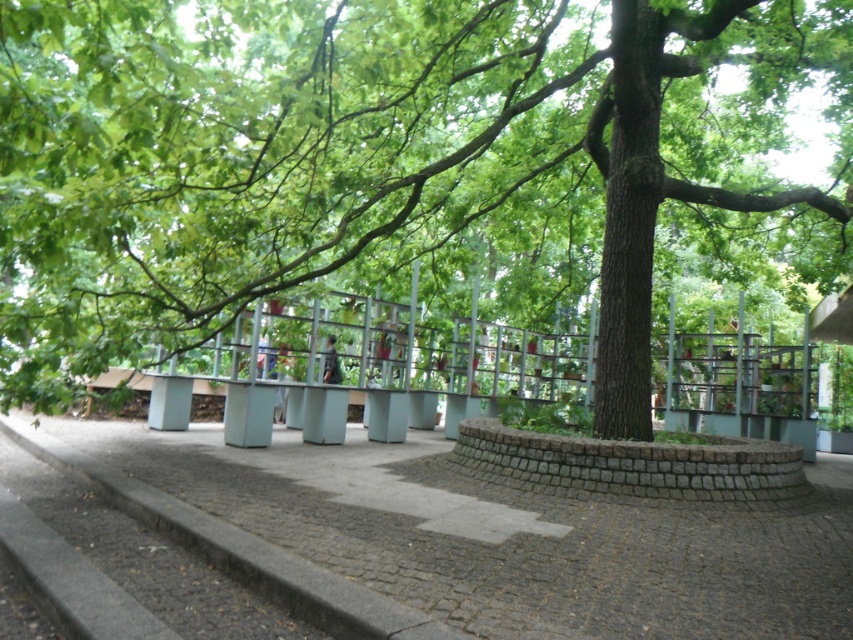
You are a gardener planning to plant a new shrub in the garden. You want to ensure it gets enough sunlight. Considering the green leafy tree at center and the gray cobblestone pavement at center, which object casts a shadow over the other?

The green leafy tree at center is located above the gray cobblestone pavement at center, so the tree casts a shadow over the pavement.

You are a gardener who wants to plant a new flower bed between the green leafy tree at center and the gray cobblestone pavement at center. Considering their sizes, which one is taller and would cast more shade over the flower bed?

The green leafy tree at center is taller than the gray cobblestone pavement at center, so it would cast more shade over the flower bed.